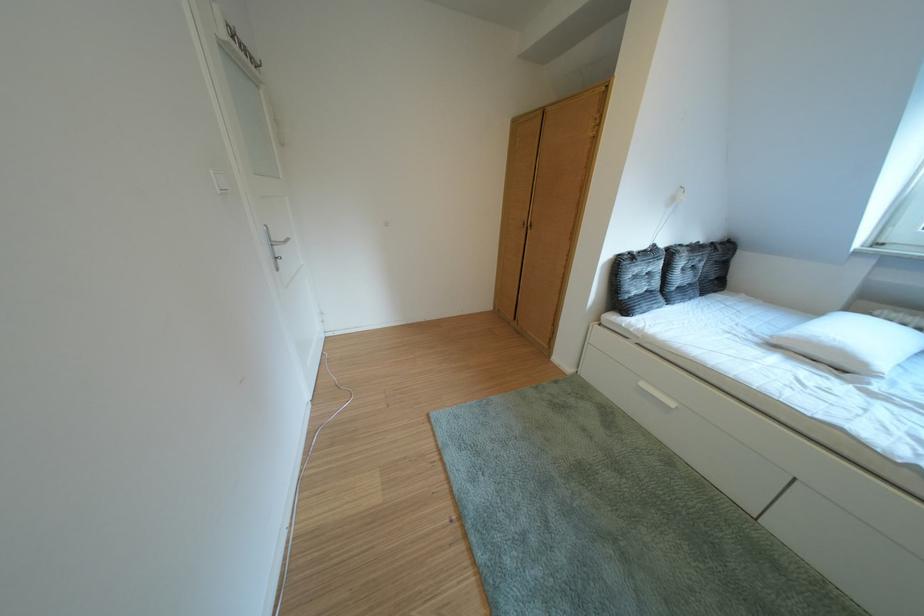
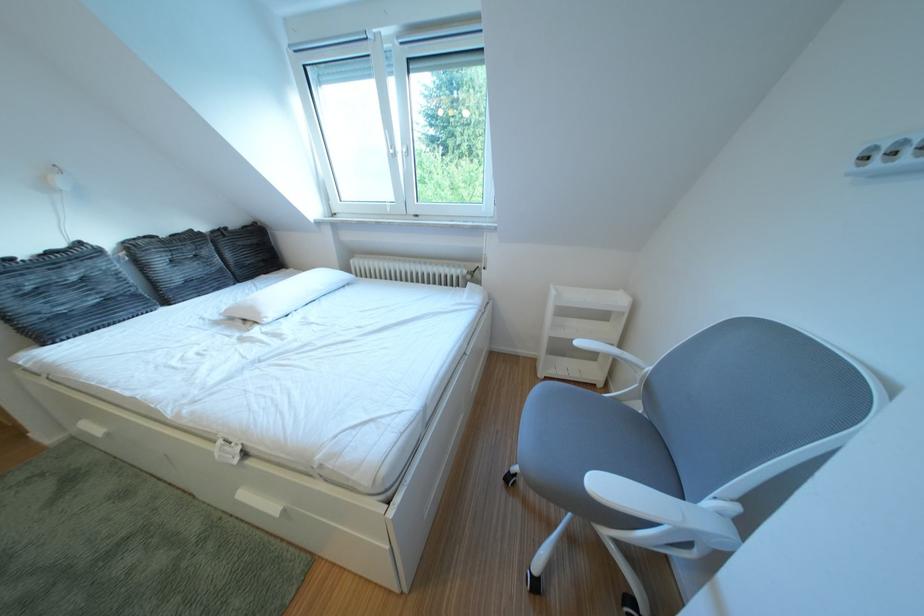
In the second image, find the point that corresponds to point 699,249 in the first image.

(176, 240)